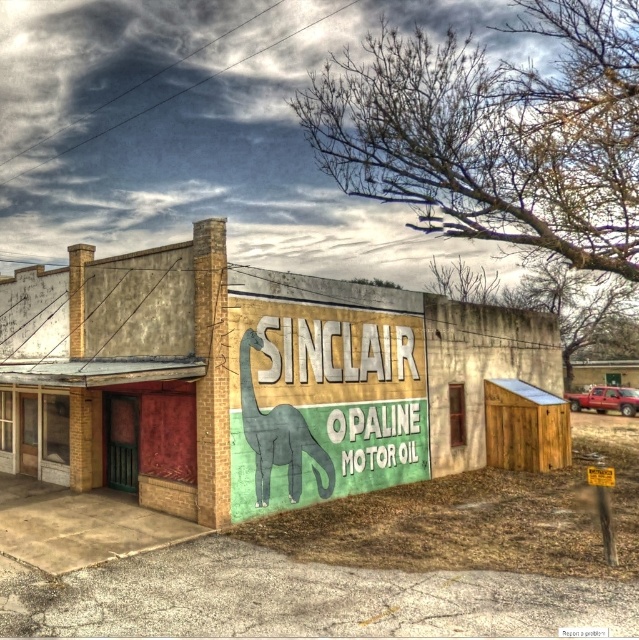
Is green matte sign at center closer to camera compared to gray matte dinosaur at center?

Yes, it is in front of gray matte dinosaur at center.

Measure the distance between point (277, 408) and camera.

14.45 meters

Locate an element on the screen. The image size is (639, 640). green matte sign at center is located at coordinates (321, 403).